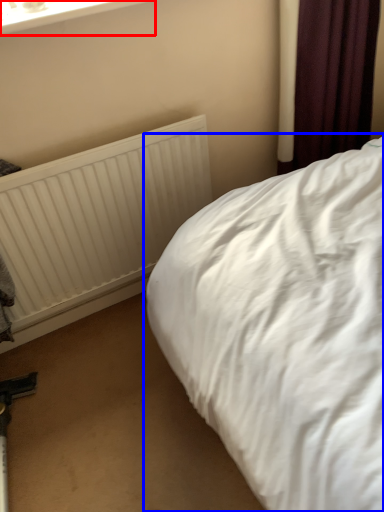
Question: Which of the following is the farthest to the observer, window frame (highlighted by a red box) or bed (highlighted by a blue box)?

Choices:
 (A) window frame
 (B) bed

Answer: (A)